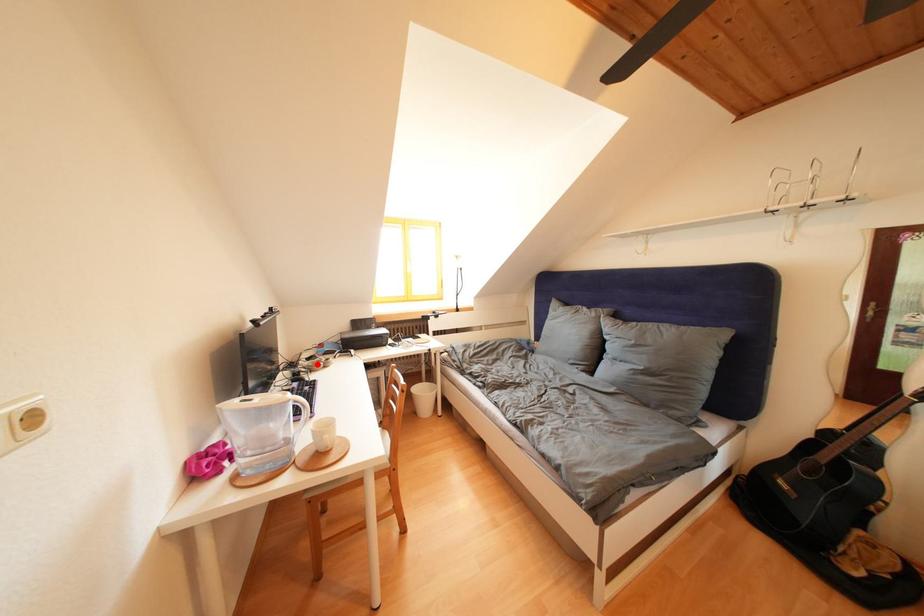
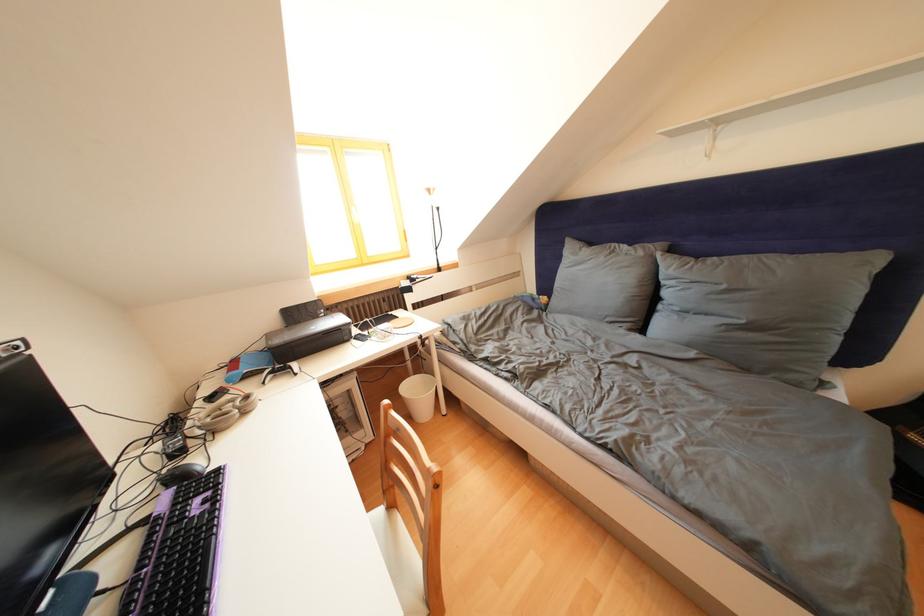
Find the pixel in the second image that matches the highlighted location in the first image.

(220, 403)